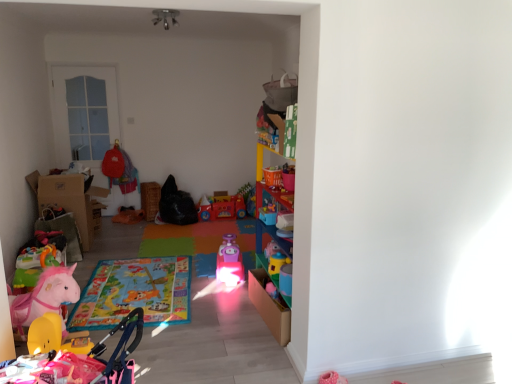
This screenshot has height=384, width=512. What do you see at coordinates (277, 263) in the screenshot? I see `matte plastic cup at center, which ranks as the fourth toy in back-to-front order` at bounding box center [277, 263].

In order to face pink plastic train at center, should I rotate leftwards or rightwards?

You should look left and rotate roughly 6.127 degrees.

Find the location of `rubber yellow toy at lower left, arranged as the 6th toy when viewed from the back`. rubber yellow toy at lower left, arranged as the 6th toy when viewed from the back is located at coordinates (73, 356).

Describe the element at coordinates (222, 207) in the screenshot. I see `rubberized plastic toy car at center, the 6th toy from the front` at that location.

In order to click on pink plush horse at lower left, which is the fifth toy in back-to-front order in this screenshot , I will do `click(45, 297)`.

What do you see at coordinates (229, 262) in the screenshot? This screenshot has height=384, width=512. I see `pink plastic toy at center, which is counted as the third toy, starting from the back` at bounding box center [229, 262].

This screenshot has width=512, height=384. Describe the element at coordinates (68, 201) in the screenshot. I see `brown cardboard box at left` at that location.

Find the location of a particular element. matte plastic cup at center, which ranks as the fourth toy in back-to-front order is located at coordinates (277, 263).

From a real-world perspective, which object rests below the other?

In real-world perspective, orange plush toy at center, which is counted as the fifth toy, starting from the front, is lower.

Measure the distance from pink plastic toy at center, the 4th toy viewed from the front, to orange plush toy at center, marked as the 2th toy in a back-to-front arrangement.

They are 2.19 meters apart.

Is pink plastic toy at center, which is counted as the third toy, starting from the back, outside of orange plush toy at center, which is counted as the fifth toy, starting from the front?

Indeed, pink plastic toy at center, which is counted as the third toy, starting from the back, is completely outside orange plush toy at center, which is counted as the fifth toy, starting from the front.

Who is taller, rubber yellow toy at lower left, arranged as the 6th toy when viewed from the back, or brown cardboard box at left?

With more height is brown cardboard box at left.

Are rubber yellow toy at lower left, arranged as the 6th toy when viewed from the back, and brown cardboard box at left beside each other?

No, rubber yellow toy at lower left, arranged as the 6th toy when viewed from the back, is not touching brown cardboard box at left.

From the image's perspective, which is below, rubber yellow toy at lower left, arranged as the 6th toy when viewed from the back, or brown cardboard box at left?

rubber yellow toy at lower left, arranged as the 6th toy when viewed from the back, from the image's perspective.

Does rubber yellow toy at lower left, arranged as the 6th toy when viewed from the back, come in front of brown cardboard box at left?

Yes, it is.

Is rubber yellow toy at lower left, which is the 1th toy from front to back, thinner than pink plastic train at center?

Yes, rubber yellow toy at lower left, which is the 1th toy from front to back, is thinner than pink plastic train at center.

From the image's perspective, which is below, rubber yellow toy at lower left, arranged as the 6th toy when viewed from the back, or pink plastic train at center?

From the image's view, rubber yellow toy at lower left, arranged as the 6th toy when viewed from the back, is below.

What's the angular difference between rubber yellow toy at lower left, which is the 1th toy from front to back, and pink plastic train at center's facing directions?

The angle between the facing direction of rubber yellow toy at lower left, which is the 1th toy from front to back, and the facing direction of pink plastic train at center is 90 degrees.

Who is taller, rubberized plastic toy car at center, marked as the first toy in a back-to-front arrangement, or orange plush toy at center, which is counted as the fifth toy, starting from the front?

With more height is rubberized plastic toy car at center, marked as the first toy in a back-to-front arrangement.

Find the location of a particular element. The image size is (512, 384). toy behind the orange plush toy at center, which is counted as the fifth toy, starting from the front is located at coordinates (222, 207).

From a real-world perspective, is rubberized plastic toy car at center, marked as the first toy in a back-to-front arrangement, physically located above or below orange plush toy at center, which is counted as the fifth toy, starting from the front?

Clearly, from a real-world perspective, rubberized plastic toy car at center, marked as the first toy in a back-to-front arrangement, is above orange plush toy at center, which is counted as the fifth toy, starting from the front.

Considering the positions of point (222, 215) and point (122, 214), is point (222, 215) closer or farther from the camera than point (122, 214)?

Clearly, point (222, 215) is closer to the camera than point (122, 214).

Would you say orange plush toy at center, marked as the 2th toy in a back-to-front arrangement, is to the left or to the right of rubber yellow toy at lower left, which is the 1th toy from front to back, in the picture?

From the image, it's evident that orange plush toy at center, marked as the 2th toy in a back-to-front arrangement, is to the left of rubber yellow toy at lower left, which is the 1th toy from front to back.

Which is in front, orange plush toy at center, which is counted as the fifth toy, starting from the front, or rubber yellow toy at lower left, arranged as the 6th toy when viewed from the back?

rubber yellow toy at lower left, arranged as the 6th toy when viewed from the back.

Between orange plush toy at center, which is counted as the fifth toy, starting from the front, and rubber yellow toy at lower left, arranged as the 6th toy when viewed from the back, which one has smaller size?

orange plush toy at center, which is counted as the fifth toy, starting from the front.

From a real-world perspective, is orange plush toy at center, marked as the 2th toy in a back-to-front arrangement, physically below rubber yellow toy at lower left, which is the 1th toy from front to back?

Yes.

From the picture: From a real-world perspective, is pink plastic train at center under rubber yellow toy at lower left, which is the 1th toy from front to back?

Yes.

From the image's perspective, which one is positioned lower, pink plastic train at center or rubber yellow toy at lower left, which is the 1th toy from front to back?

rubber yellow toy at lower left, which is the 1th toy from front to back, from the image's perspective.

Would you consider pink plastic train at center to be distant from rubber yellow toy at lower left, arranged as the 6th toy when viewed from the back?

Indeed, pink plastic train at center is not near rubber yellow toy at lower left, arranged as the 6th toy when viewed from the back.

From the brown cardboard box at left, count 5th toy to the right and point to it. Please provide its 2D coordinates.

[(229, 262)]

Is brown cardboard box at left inside or outside of pink plastic toy at center, which is counted as the third toy, starting from the back?

brown cardboard box at left is spatially situated outside pink plastic toy at center, which is counted as the third toy, starting from the back.

Considering their positions, is brown cardboard box at left located in front of or behind pink plastic toy at center, the 4th toy viewed from the front?

Clearly, brown cardboard box at left is behind pink plastic toy at center, the 4th toy viewed from the front.

Locate an element on the screen. The image size is (512, 384). the 4th toy counting from the left of the pink plastic toy at center, which is counted as the third toy, starting from the back is located at coordinates (128, 215).

The image size is (512, 384). In order to click on toy that is the 4th one when counting forward from the brown cardboard box at left in this screenshot , I will do `click(73, 356)`.

Estimate the real-world distances between objects in this image. Which object is further from pink plush horse at lower left, the second toy when ordered from front to back, rubber yellow toy at lower left, arranged as the 6th toy when viewed from the back, or multicolored carpet at center?

Based on the image, multicolored carpet at center appears to be further to pink plush horse at lower left, the second toy when ordered from front to back.

Which object lies further to the anchor point pink plush horse at lower left, which is the fifth toy in back-to-front order, brown cardboard box at left or rubberized plastic toy car at center, marked as the first toy in a back-to-front arrangement?

rubberized plastic toy car at center, marked as the first toy in a back-to-front arrangement, is positioned further to the anchor pink plush horse at lower left, which is the fifth toy in back-to-front order.

In the scene shown: Based on their spatial positions, is multicolored carpet at center or pink plastic toy at center, which is counted as the third toy, starting from the back, closer to brown cardboard box at left?

multicolored carpet at center.

From the image, which object appears to be farther from pink plush horse at lower left, which is the fifth toy in back-to-front order, rubber yellow toy at lower left, which is the 1th toy from front to back, or orange plush toy at center, which is counted as the fifth toy, starting from the front?

orange plush toy at center, which is counted as the fifth toy, starting from the front, is further to pink plush horse at lower left, which is the fifth toy in back-to-front order.

When comparing their distances from rubber yellow toy at lower left, arranged as the 6th toy when viewed from the back, does pink plastic train at center or pink plastic toy at center, the 4th toy viewed from the front, seem further?

Among the two, pink plastic train at center is located further to rubber yellow toy at lower left, arranged as the 6th toy when viewed from the back.

From the image, which object appears to be farther from multicolored carpet at center, orange plush toy at center, marked as the 2th toy in a back-to-front arrangement, or pink plush horse at lower left, the second toy when ordered from front to back?

Among the two, orange plush toy at center, marked as the 2th toy in a back-to-front arrangement, is located further to multicolored carpet at center.

Considering their positions, is pink plastic toy at center, the 4th toy viewed from the front, positioned closer to brown cardboard box at left than matte plastic cup at center, which ranks as the fourth toy in back-to-front order?

pink plastic toy at center, the 4th toy viewed from the front, is closer to brown cardboard box at left.

Considering their positions, is brown cardboard box at left positioned further to pink plush horse at lower left, the second toy when ordered from front to back, than matte plastic cup at center, which ranks as the fourth toy in back-to-front order?

brown cardboard box at left is positioned further to the anchor pink plush horse at lower left, the second toy when ordered from front to back.

Locate an element on the screen. plain between rubber yellow toy at lower left, which is the 1th toy from front to back, and rubberized plastic toy car at center, the 6th toy from the front, in the front-back direction is located at coordinates 199,242.

Locate an element on the screen. The height and width of the screenshot is (384, 512). mat located between brown cardboard box at left and pink plastic train at center in the left-right direction is located at coordinates (135, 293).

Find the location of a particular element. plain located between multicolored carpet at center and orange plush toy at center, which is counted as the fifth toy, starting from the front, in the depth direction is located at coordinates (199, 242).

Find the location of a particular element. mat located between brown cardboard box at left and matte plastic cup at center, which ranks as the fourth toy in back-to-front order, in the left-right direction is located at coordinates (135, 293).